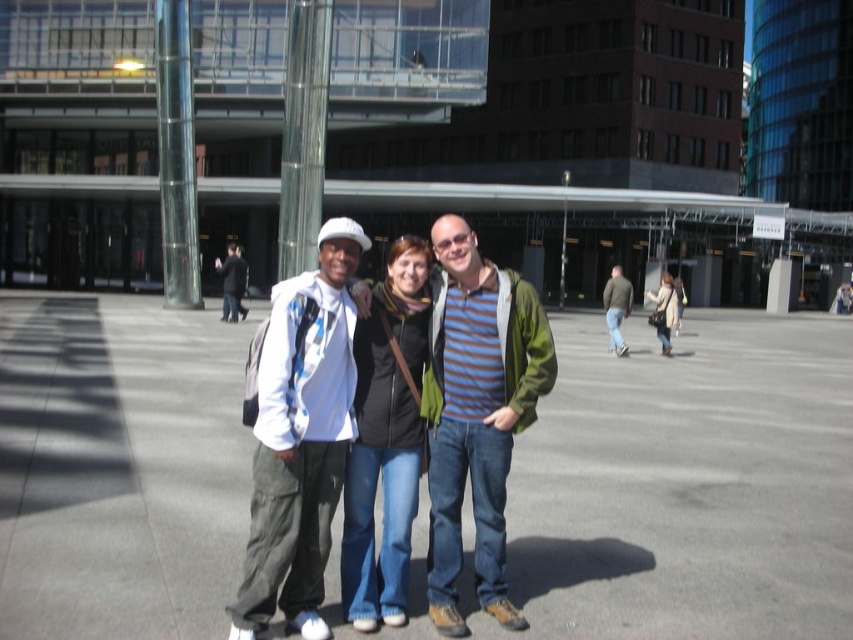
You are a fashion designer observing the striped cotton shirt at center and the green textured jacket at right in the scene. Which garment has a shorter length?

The striped cotton shirt at center is shorter than the green textured jacket at right.

You are a fashion designer observing the scene. You notice the matte white jacket at center and the green textured jacket at right. Which jacket would you recommend to a client who prefers a more compact and portable option?

The matte white jacket at center is smaller than the green textured jacket at right, so it would be more suitable for someone seeking a compact and portable option.